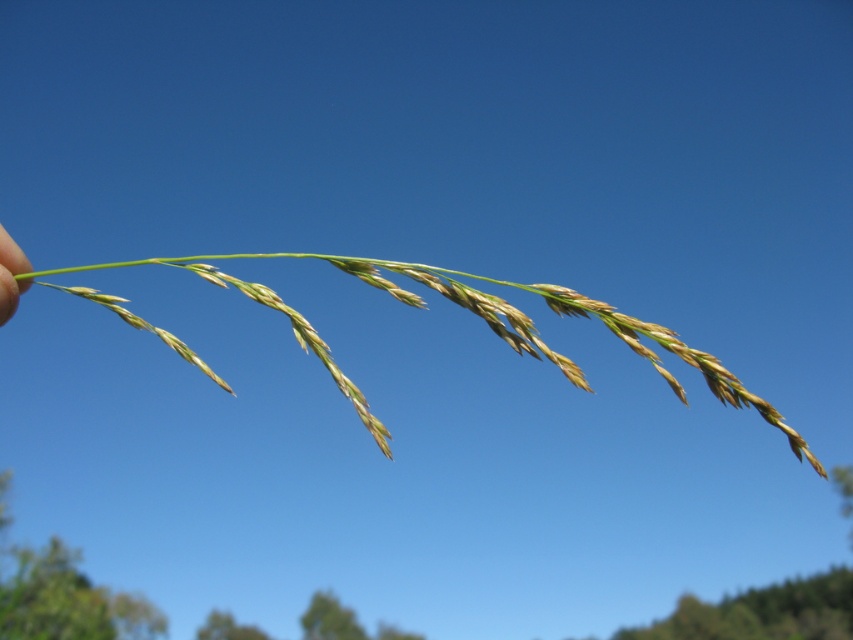
Question: Considering the relative positions of green grass at center and skinny green stem at left in the image provided, where is green grass at center located with respect to skinny green stem at left?

Choices:
 (A) above
 (B) below

Answer: (B)

Question: Can you confirm if green grass at center is wider than skinny green stem at left?

Choices:
 (A) no
 (B) yes

Answer: (B)

Question: Is green grass at center smaller than skinny green stem at left?

Choices:
 (A) no
 (B) yes

Answer: (A)